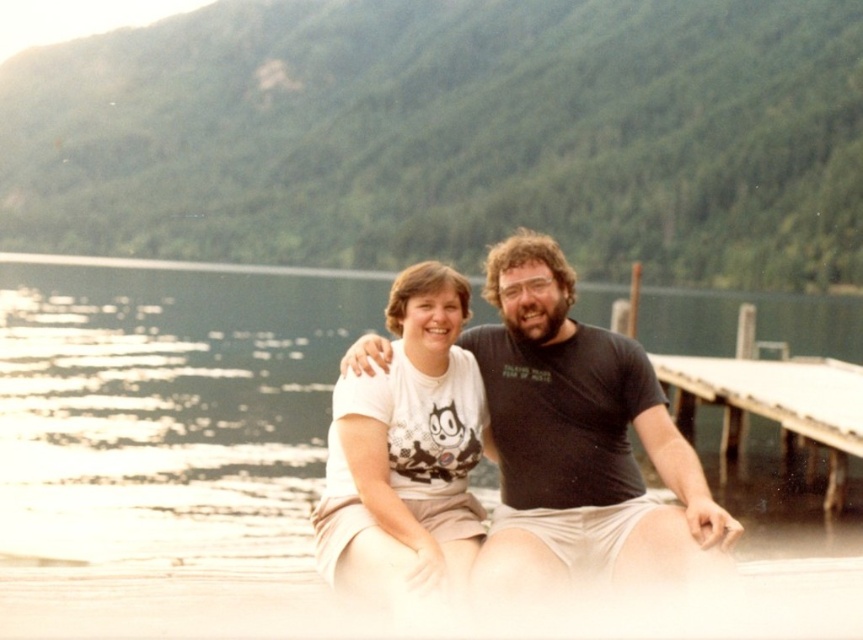
Question: Does green matte water at center have a greater width compared to white wooden dock at right?

Choices:
 (A) no
 (B) yes

Answer: (B)

Question: Estimate the real-world distances between objects in this image. Which object is farther from the green matte water at center?

Choices:
 (A) white wooden dock at right
 (B) black matte t-shirt at center
 (C) white cotton t-shirt at center

Answer: (C)

Question: Does green matte water at center have a lesser width compared to black matte t-shirt at center?

Choices:
 (A) no
 (B) yes

Answer: (A)

Question: Among these objects, which one is farthest from the camera?

Choices:
 (A) black matte t-shirt at center
 (B) white wooden dock at right
 (C) white cotton t-shirt at center

Answer: (B)

Question: Which point is farther from the camera taking this photo?

Choices:
 (A) (249, 292)
 (B) (423, 532)
 (C) (836, 410)

Answer: (A)

Question: Observing the image, what is the correct spatial positioning of black matte t-shirt at center in reference to white cotton t-shirt at center?

Choices:
 (A) below
 (B) above

Answer: (B)